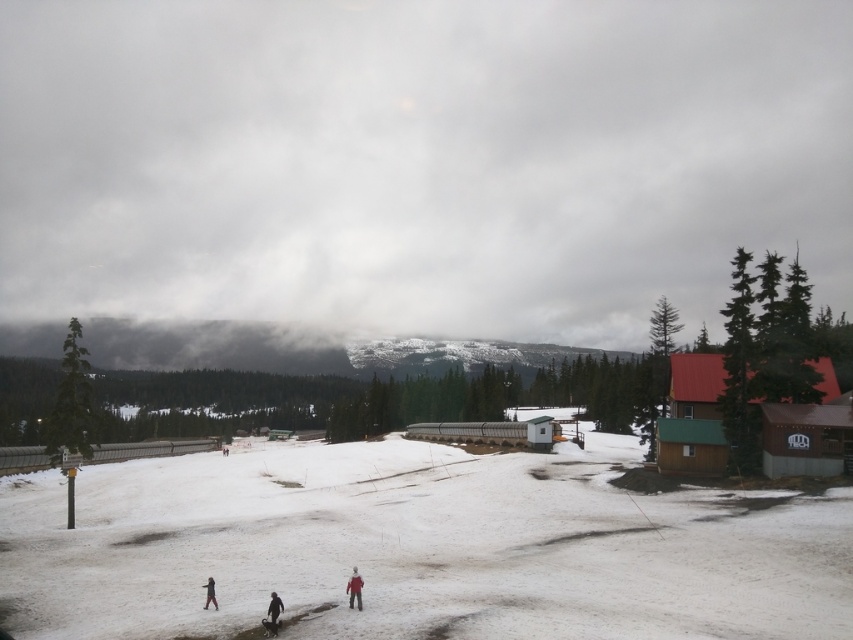
Question: Is white snow at center wider than red woolen jacket at lower center?

Choices:
 (A) yes
 (B) no

Answer: (A)

Question: Which object is closer to the camera taking this photo?

Choices:
 (A) dark gray fabric jacket at lower center
 (B) red woolen jacket at lower center
 (C) dark red jacket at lower center
 (D) white snow at center

Answer: (D)

Question: Does white snow at center appear under dark red jacket at lower center?

Choices:
 (A) no
 (B) yes

Answer: (B)

Question: Which object appears farthest from the camera in this image?

Choices:
 (A) red woolen jacket at lower center
 (B) white snow at center

Answer: (A)

Question: Which object is closer to the camera taking this photo?

Choices:
 (A) red woolen jacket at lower center
 (B) dark red jacket at lower center
 (C) white snow at center

Answer: (C)

Question: Is dark gray fabric jacket at lower center below dark red jacket at lower center?

Choices:
 (A) no
 (B) yes

Answer: (A)